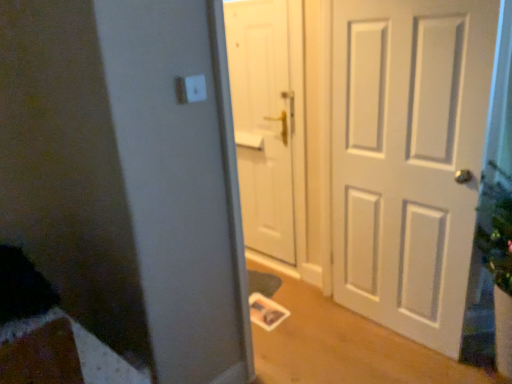
Locate an element on the screen. vacant point to the left of white matte door at right, the 2th door from the left is located at coordinates (327, 333).